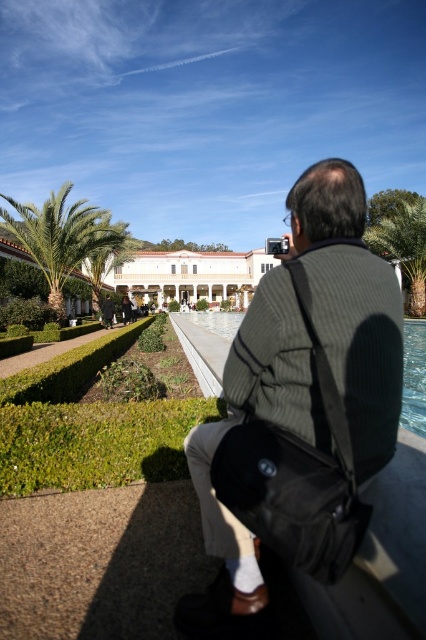
Is green leafy palm tree at left to the left of green leafy palm tree at upper right from the viewer's perspective?

Yes, green leafy palm tree at left is to the left of green leafy palm tree at upper right.

Who is positioned more to the left, green leafy palm tree at left or green leafy palm tree at upper right?

From the viewer's perspective, green leafy palm tree at left appears more on the left side.

Is point (57, 227) in front of point (417, 269)?

Yes, it is.

Where is `green leafy palm tree at left`? green leafy palm tree at left is located at coordinates (62, 236).

Can you confirm if dark gray knitted sweater at center is positioned to the right of green leafy palm tree at left?

Yes, dark gray knitted sweater at center is to the right of green leafy palm tree at left.

Is dark gray knitted sweater at center thinner than green leafy palm tree at left?

Answer: Correct, dark gray knitted sweater at center's width is less than green leafy palm tree at left's.

Which is in front, point (293, 310) or point (111, 243)?

Positioned in front is point (293, 310).

At what (x,y) coordinates should I click in order to perform the action: click on dark gray knitted sweater at center. Please return your answer as a coordinate pair (x, y). The image size is (426, 640). Looking at the image, I should click on (351, 305).

Between dark gray knitted sweater at center and clear glass pool at center, which one appears on the left side from the viewer's perspective?

Positioned to the left is dark gray knitted sweater at center.

Can you confirm if dark gray knitted sweater at center is smaller than clear glass pool at center?

Indeed, dark gray knitted sweater at center has a smaller size compared to clear glass pool at center.

You are a GUI agent. You are given a task and a screenshot of the screen. Output one action in this format:
    pyautogui.click(x=<x>, y=<y>)
    Task: Click on the dark gray knitted sweater at center
    
    Given the screenshot: What is the action you would take?
    pyautogui.click(x=351, y=305)